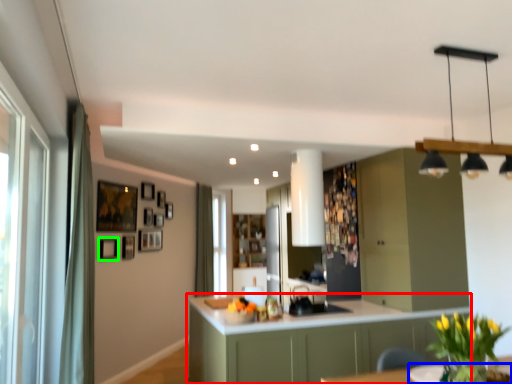
Question: Which object is the farthest from cabinetry (highlighted by a red box)? Choose among these: round table (highlighted by a blue box) or picture frame (highlighted by a green box).

Choices:
 (A) round table
 (B) picture frame

Answer: (B)